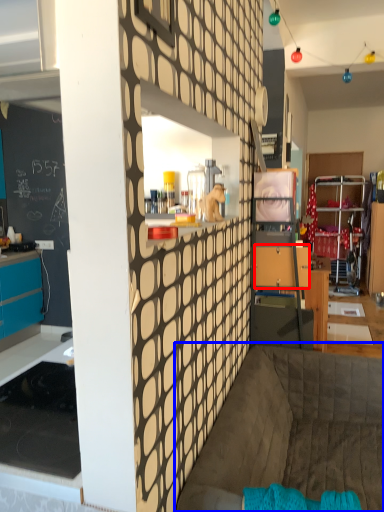
Question: Which point is closer to the camera, drawer (highlighted by a red box) or couch (highlighted by a blue box)?

Choices:
 (A) drawer
 (B) couch

Answer: (B)